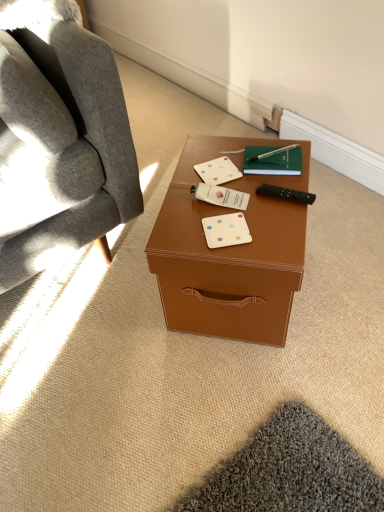
Question: Is black plastic remote control at right to the right of white matte business card at center, positioned as the second business card in front-to-back order, from the viewer's perspective?

Choices:
 (A) no
 (B) yes

Answer: (B)

Question: Is black plastic remote control at right outside white matte business card at center, the second business card in the top-to-bottom sequence?

Choices:
 (A) yes
 (B) no

Answer: (A)

Question: From a real-world perspective, is black plastic remote control at right located beneath white matte business card at center, arranged as the second business card when ordered from the bottom?

Choices:
 (A) yes
 (B) no

Answer: (A)

Question: From a real-world perspective, is black plastic remote control at right on white matte business card at center, marked as the 2th business card in a back-to-front arrangement?

Choices:
 (A) no
 (B) yes

Answer: (A)

Question: Considering the relative sizes of black plastic remote control at right and white matte business card at center, arranged as the second business card when ordered from the bottom, in the image provided, is black plastic remote control at right thinner than white matte business card at center, arranged as the second business card when ordered from the bottom,?

Choices:
 (A) no
 (B) yes

Answer: (B)

Question: Is white matte business card at center, which is counted as the first business card, starting from the bottom, bigger or smaller than black plastic remote control at right?

Choices:
 (A) small
 (B) big

Answer: (A)

Question: Considering their positions, is white matte business card at center, the 1th business card viewed from the front, located in front of or behind black plastic remote control at right?

Choices:
 (A) front
 (B) behind

Answer: (A)

Question: From a real-world perspective, relative to black plastic remote control at right, is white matte business card at center, the 1th business card viewed from the front, vertically above or below?

Choices:
 (A) below
 (B) above

Answer: (A)

Question: In terms of height, does white matte business card at center, the 3th business card when ordered from back to front, look taller or shorter compared to black plastic remote control at right?

Choices:
 (A) short
 (B) tall

Answer: (A)

Question: Considering their positions, is brown leather desk at center located in front of or behind green matte notebook at center?

Choices:
 (A) behind
 (B) front

Answer: (B)

Question: Is brown leather desk at center taller or shorter than green matte notebook at center?

Choices:
 (A) tall
 (B) short

Answer: (A)

Question: Is brown leather desk at center inside the boundaries of green matte notebook at center, or outside?

Choices:
 (A) outside
 (B) inside

Answer: (A)

Question: Considering the relative positions of brown leather desk at center and green matte notebook at center in the image provided, is brown leather desk at center to the left or to the right of green matte notebook at center?

Choices:
 (A) left
 (B) right

Answer: (A)

Question: Is brown leather desk at center bigger or smaller than soft gray fabric chair at left?

Choices:
 (A) small
 (B) big

Answer: (A)

Question: Is brown leather desk at center spatially inside soft gray fabric chair at left, or outside of it?

Choices:
 (A) outside
 (B) inside

Answer: (A)